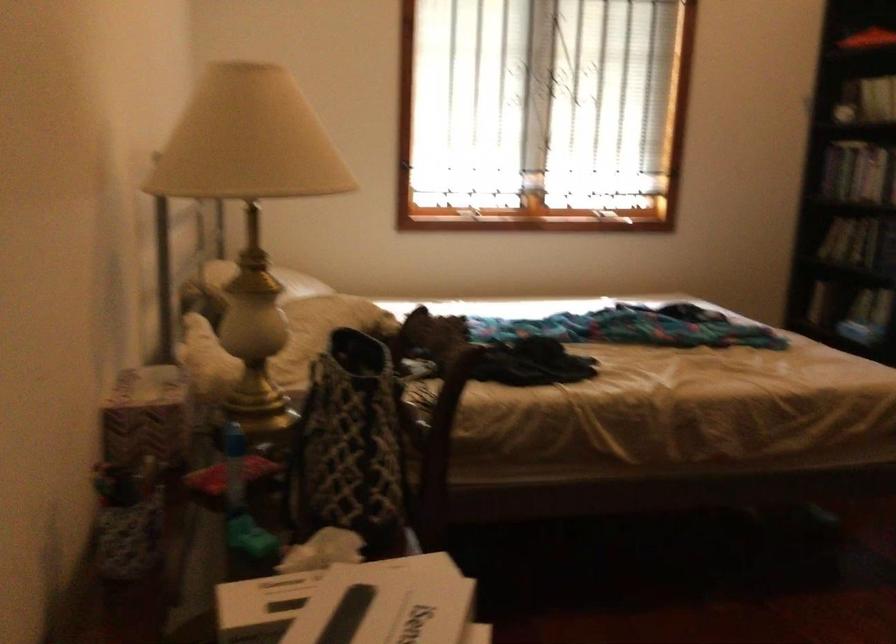
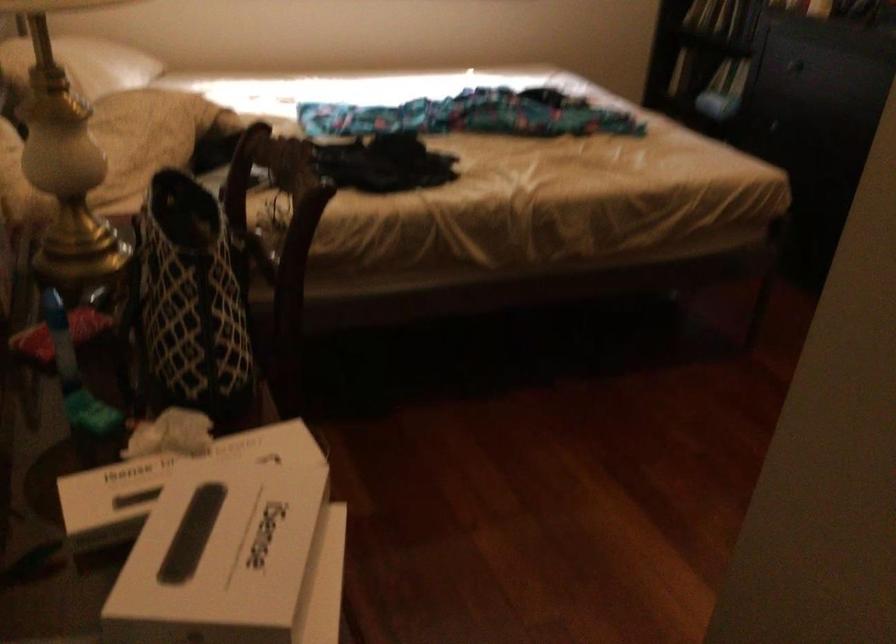
Question: Which direction would the cameraman need to move to produce the second image? Reply with the corresponding letter.

Choices:
 (A) Left
 (B) Right
 (C) Forward
 (D) Backward

Answer: (C)